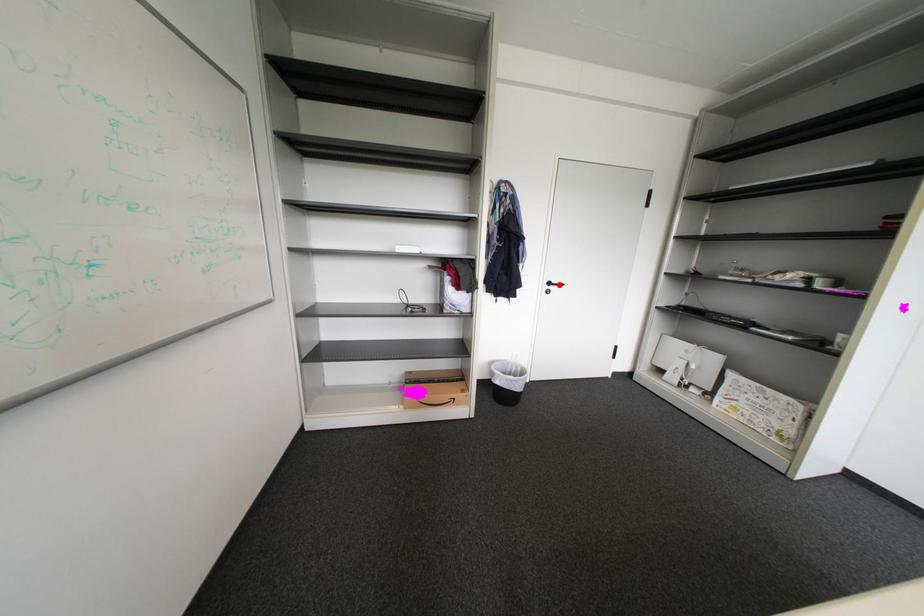
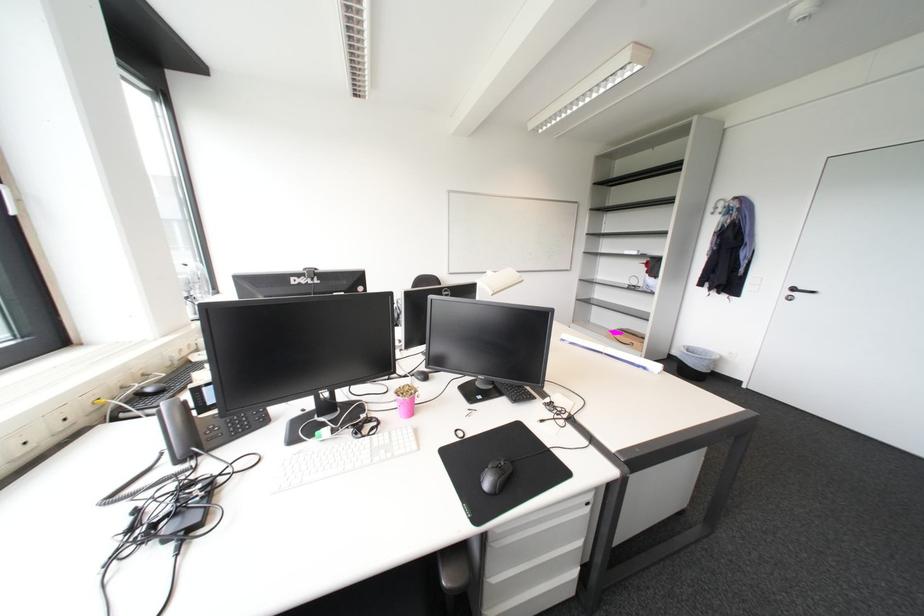
Where in the second image is the point corresponding to the highlighted location from the first image?

(805, 291)